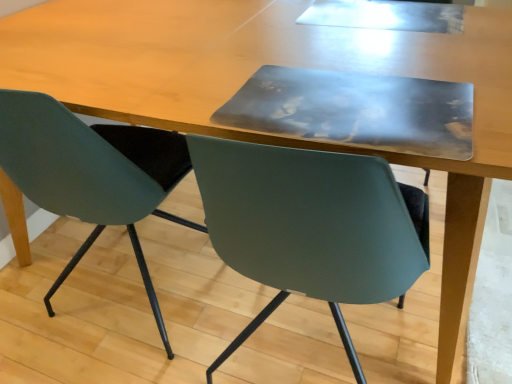
Where is `matte green chair at center`? This screenshot has height=384, width=512. matte green chair at center is located at coordinates (91, 172).

This screenshot has height=384, width=512. Describe the element at coordinates (91, 172) in the screenshot. I see `matte green chair at center` at that location.

Find the location of a particular element. matte green chair at center is located at coordinates (91, 172).